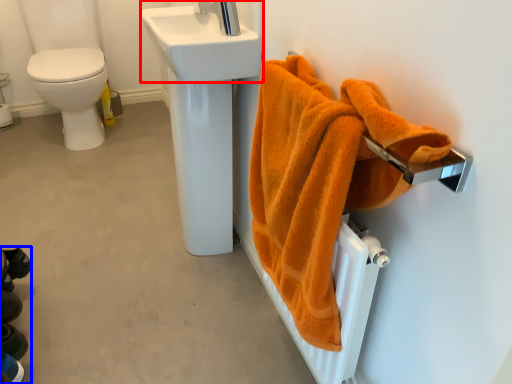
Question: Which object appears closest to the camera in this image, sink (highlighted by a red box) or squat (highlighted by a blue box)?

Choices:
 (A) sink
 (B) squat

Answer: (B)